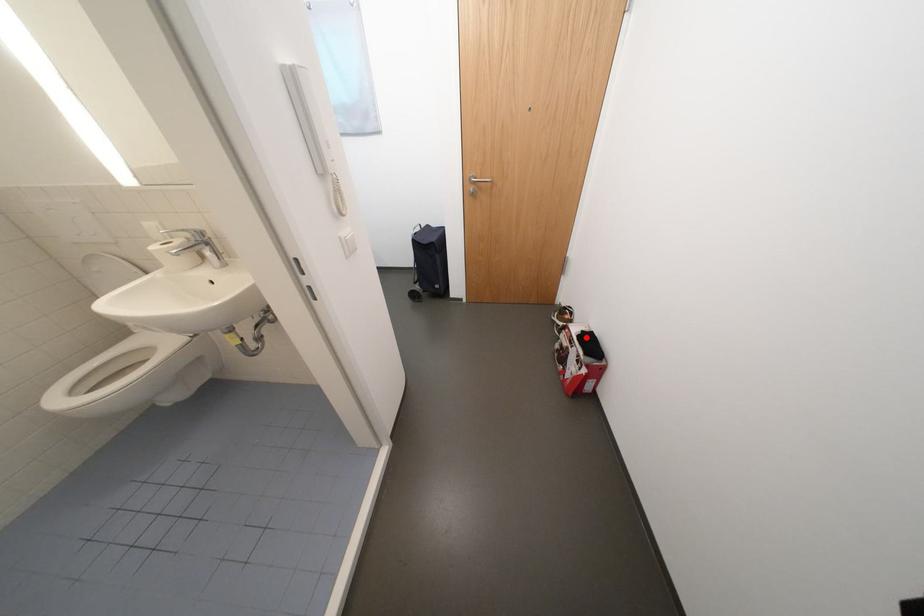
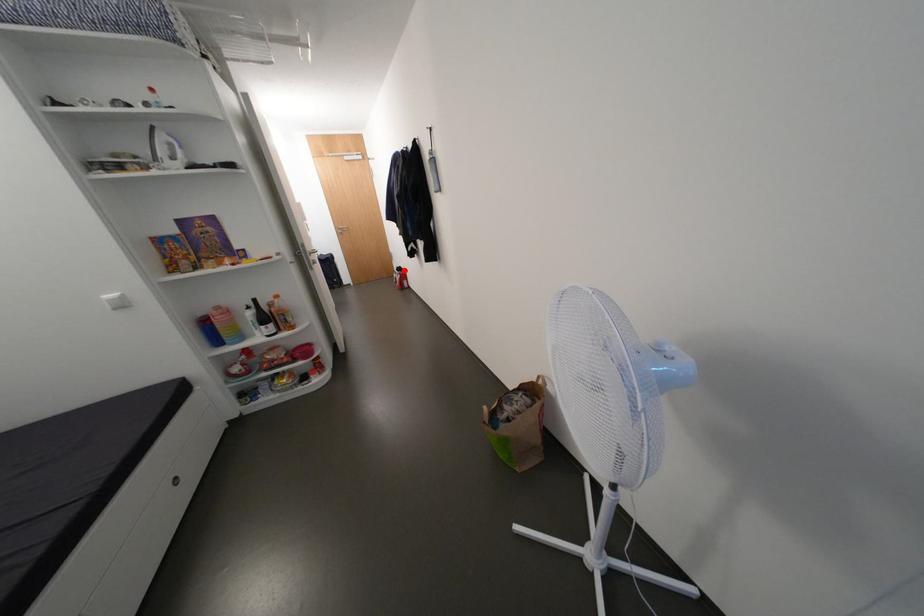
I am providing you with two images of the same scene from different viewpoints. A red point is marked on the first image and another point is marked on the second image. Does the point marked in image1 correspond to the same location as the one in image2?

Yes